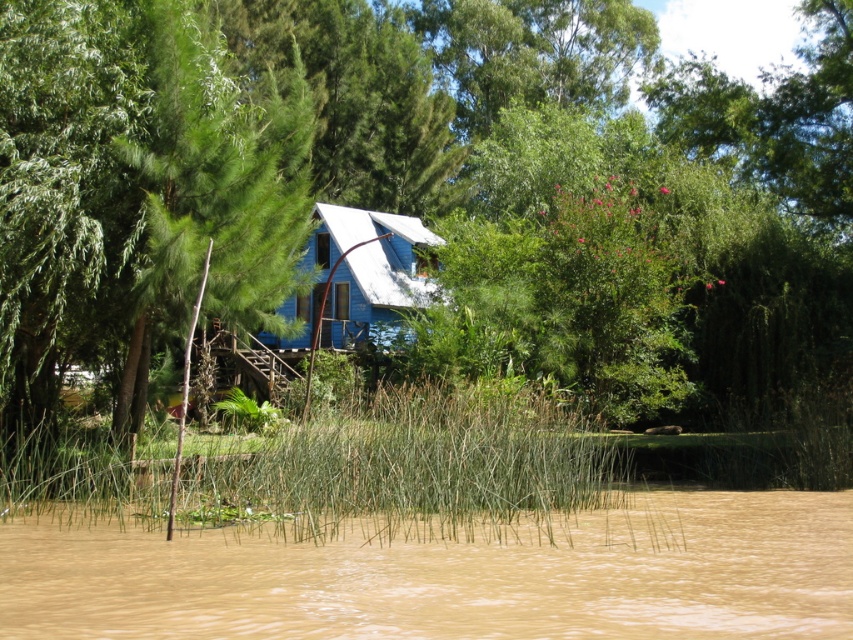
Question: Among these objects, which one is farthest from the camera?

Choices:
 (A) green leafy tree at center
 (B) brown muddy water at lower center
 (C) green grassy reed at center

Answer: (A)

Question: Is brown muddy water at lower center to the right of green grassy reed at center from the viewer's perspective?

Choices:
 (A) no
 (B) yes

Answer: (B)

Question: Which of the following is the farthest from the observer?

Choices:
 (A) green leafy tree at center
 (B) green grassy reed at center

Answer: (A)

Question: Is green leafy tree at center positioned in front of green grassy reed at center?

Choices:
 (A) yes
 (B) no

Answer: (B)

Question: Among these objects, which one is farthest from the camera?

Choices:
 (A) green leafy tree at center
 (B) green grassy reed at center
 (C) brown muddy water at lower center

Answer: (A)

Question: Is brown muddy water at lower center below green grassy reed at center?

Choices:
 (A) yes
 (B) no

Answer: (A)